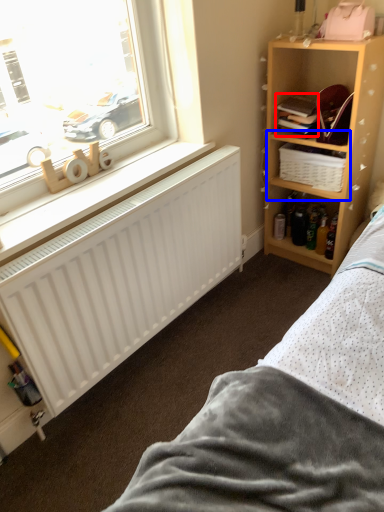
Question: Which object appears farthest to the camera in this image, book (highlighted by a red box) or cabinet (highlighted by a blue box)?

Choices:
 (A) book
 (B) cabinet

Answer: (B)